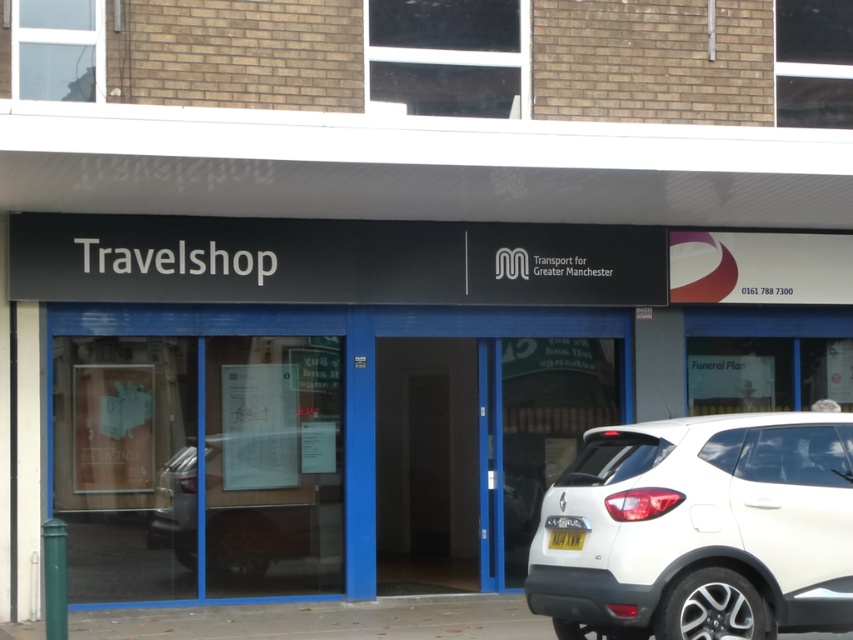
You are a delivery driver who needs to enter the Travelshop storefront. You see the white glossy door at center and the yellow plastic license plate at lower center. Which object is taller?

The white glossy door at center is much taller than the yellow plastic license plate at lower center.

You are a delivery driver arriving at the Travelshop location. You need to enter the premises through the correct entrance. According to the image, where is the white glossy door at center located in relation to the yellow plastic license plate at lower center?

The white glossy door at center is positioned under the yellow plastic license plate at lower center.